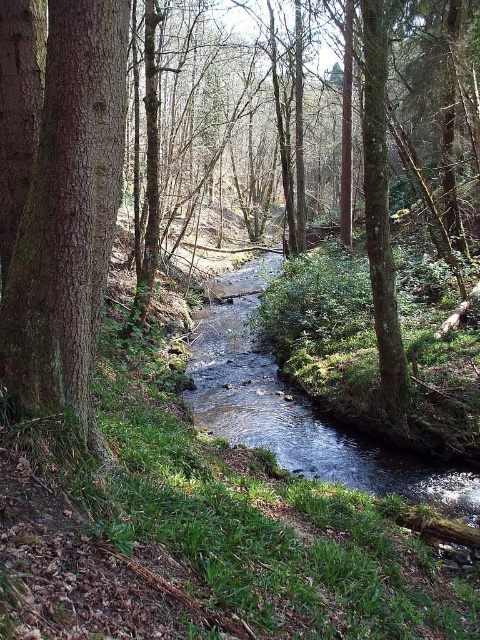
You are standing at the origin point in the forest scene. You need to locate the brown rough tree at center. Which direction should you move to reach it?

The brown rough tree at center is located at coordinates point (x=62, y=205). Since you are at the origin, you should move towards the positive x and positive y direction to reach it.

You are standing at the center of the forest scene. You see a point marked at coordinates (x=68, y=216). What object is located at that point?

The point at coordinates (x=68, y=216) marks the location of a smooth brown tree trunk at left.

You are a hiker who wants to cross the stream. You see the smooth brown tree trunk at left and the clear water at center. Which object is shorter in height?

The smooth brown tree trunk at left is not as tall as the clear water at center, so the smooth brown tree trunk at left is shorter in height.